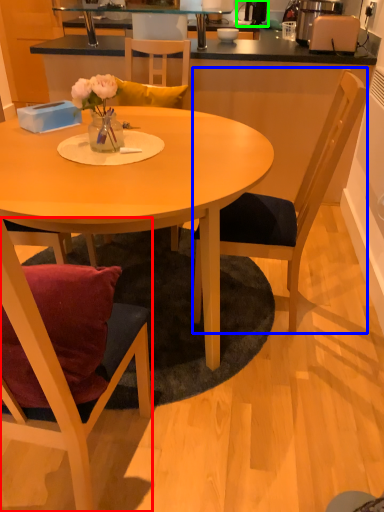
Question: Which object is positioned closest to chair (highlighted by a red box)? Select from chair (highlighted by a blue box) and coffee machine (highlighted by a green box).

Choices:
 (A) chair
 (B) coffee machine

Answer: (A)